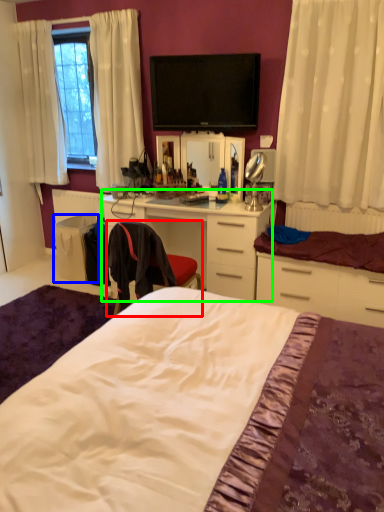
Question: Based on their relative distances, which object is nearer to chair (highlighted by a red box)? Choose from trash bin/can (highlighted by a blue box) and desk (highlighted by a green box).

Choices:
 (A) trash bin/can
 (B) desk

Answer: (B)